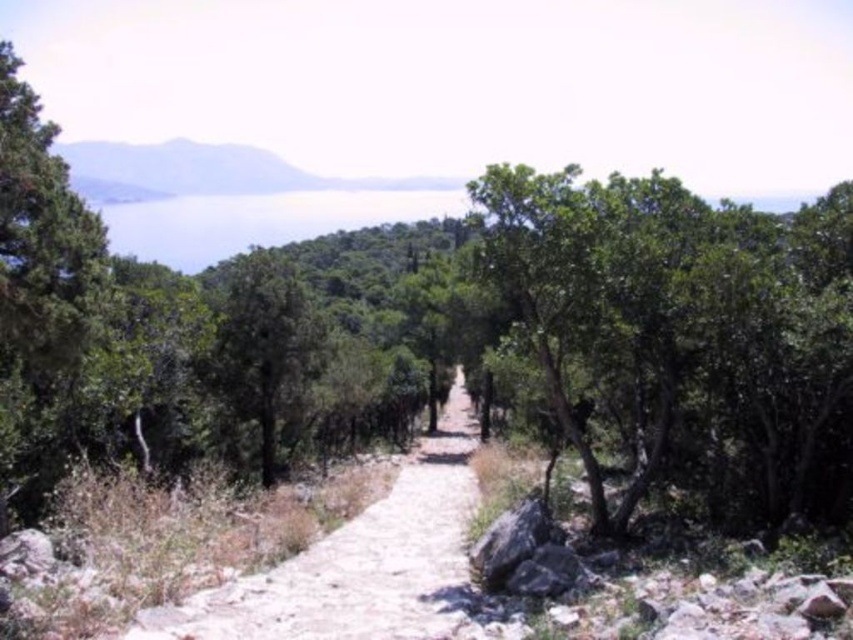
Question: In this image, where is green leafy tree at center located relative to dusty stone path at center?

Choices:
 (A) below
 (B) above

Answer: (B)

Question: Among these objects, which one is farthest from the camera?

Choices:
 (A) green leafy tree at center
 (B) dusty stone path at center

Answer: (A)

Question: Is green leafy tree at center below dusty stone path at center?

Choices:
 (A) no
 (B) yes

Answer: (A)

Question: Does green leafy tree at center have a lesser width compared to dusty stone path at center?

Choices:
 (A) yes
 (B) no

Answer: (B)

Question: Among these objects, which one is nearest to the camera?

Choices:
 (A) dusty stone path at center
 (B) green leafy tree at center

Answer: (A)

Question: Among these points, which one is farthest from the camera?

Choices:
 (A) (833, 307)
 (B) (291, 618)

Answer: (A)